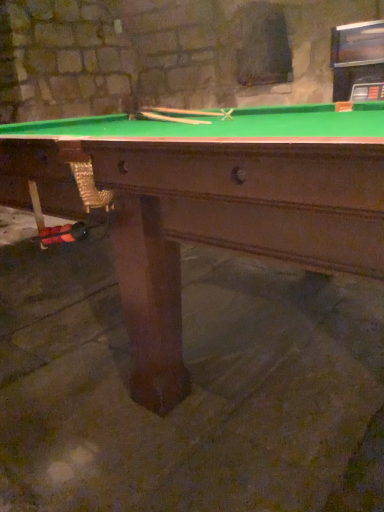
Question: From the image's perspective, is wooden cue at center, the first cue when ordered from bottom to top, located above or below green felt pool table at center?

Choices:
 (A) above
 (B) below

Answer: (A)

Question: From a real-world perspective, relative to green felt pool table at center, is wooden cue at center, which ranks as the 2th cue in top-to-bottom order, vertically above or below?

Choices:
 (A) above
 (B) below

Answer: (A)

Question: Which is farther from the wooden cue at center, the second cue ordered from the bottom?

Choices:
 (A) green felt pool table at center
 (B) wooden cue at center, which ranks as the 2th cue in top-to-bottom order

Answer: (A)

Question: Based on their relative distances, which object is nearer to the wooden cue at center, the first cue when ordered from bottom to top?

Choices:
 (A) green felt pool table at center
 (B) wooden cue at center, the first cue in the top-to-bottom sequence

Answer: (A)